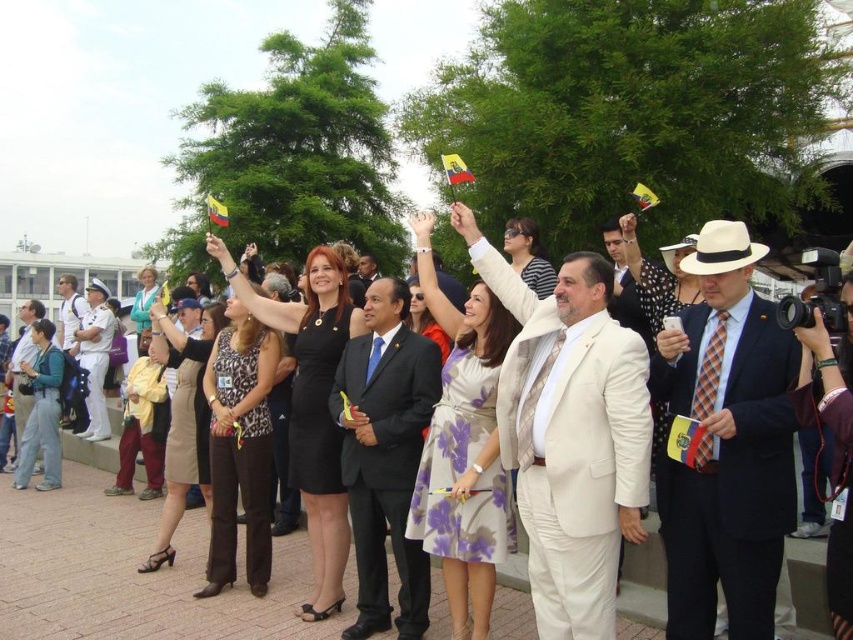
In the scene shown: You are organizing a photo shoot and need to arrange two men in matte black suits. The first is wearing the matte black suit at center and the second is wearing the matte black suit at left. If you want to place them side by side in a way that the narrower one is on the left, which man should be positioned where?

The matte black suit at center has a lesser width compared to the matte black suit at left. To place the narrower one on the left, the man in the matte black suit at center should be positioned on the left side, and the man in the matte black suit at left should be on the right side.

You are a photographer standing at the edge of the crowd, and you want to take a photo that includes both the matte black suit at center and the matte black suit at left. Given that your camera has a maximum focus range of 30 meters, will you be able to capture both subjects clearly in the same frame?

The matte black suit at center is 35.19 meters away from the matte black suit at left. Since the distance between them exceeds the camera maximum focus range of 30 meters, you won t be able to capture both subjects clearly in the same frame.

You are a photographer at the event and want to capture a photo that includes both the matte black suit at center and the matte black suit at left. Based on their positions, which one will appear lower in the photo?

The matte black suit at center will appear lower in the photo because it is located below the matte black suit at left.